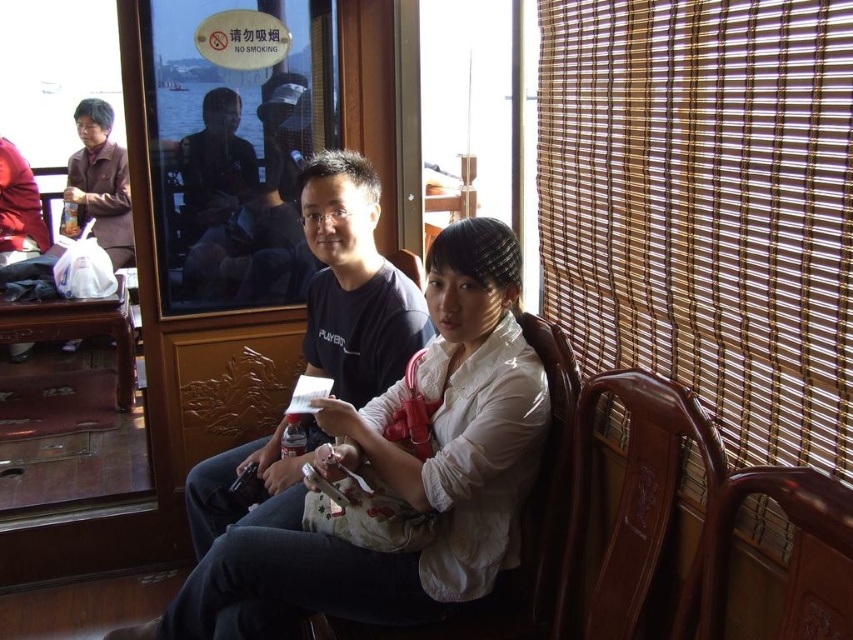
You are on a boat and need to locate the transparent glass window at upper center and the wooden at right. According to the scene, which object is positioned to the left of the other?

The transparent glass window at upper center is to the left of wooden at right.

You are standing in the enclosed space and want to hand a document to the person wearing the black matte shirt at center without disturbing the wooden at right. Which direction should you move towards?

The black matte shirt at center is closer to you than the wooden at right, so you should move towards the direction of the black matte shirt at center to hand the document without disturbing the wooden at right.